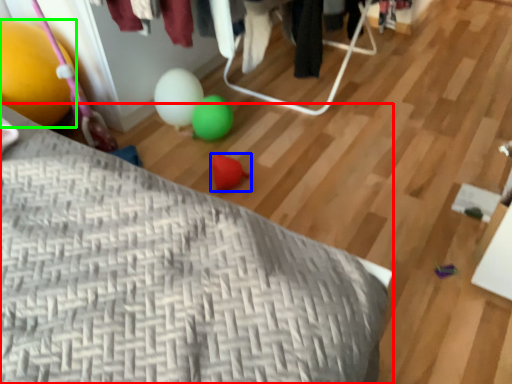
Question: Which object is the farthest from furniture (highlighted by a red box)? Choose among these: toy (highlighted by a blue box) or balloon (highlighted by a green box).

Choices:
 (A) toy
 (B) balloon

Answer: (A)